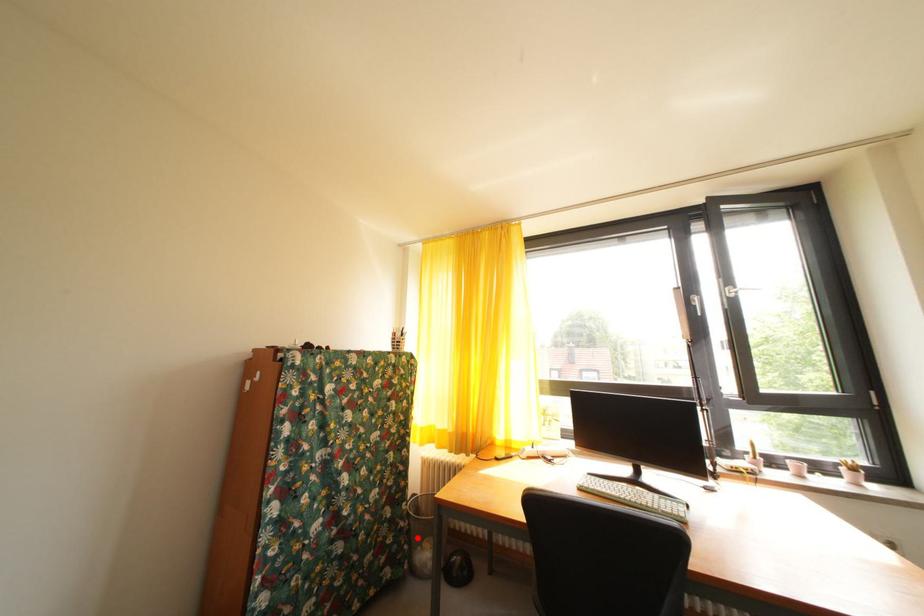
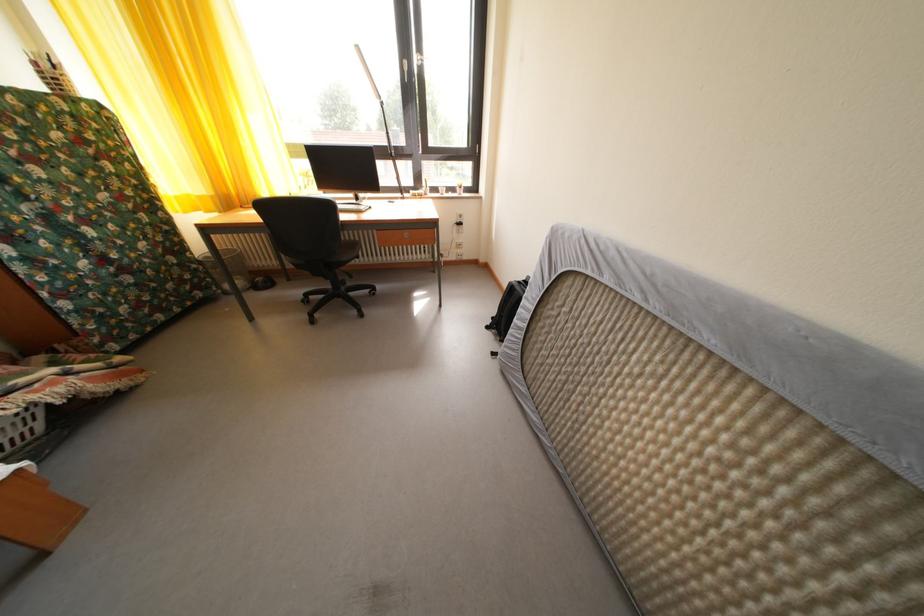
Locate, in the second image, the point that corresponds to the highlighted location in the first image.

(215, 278)